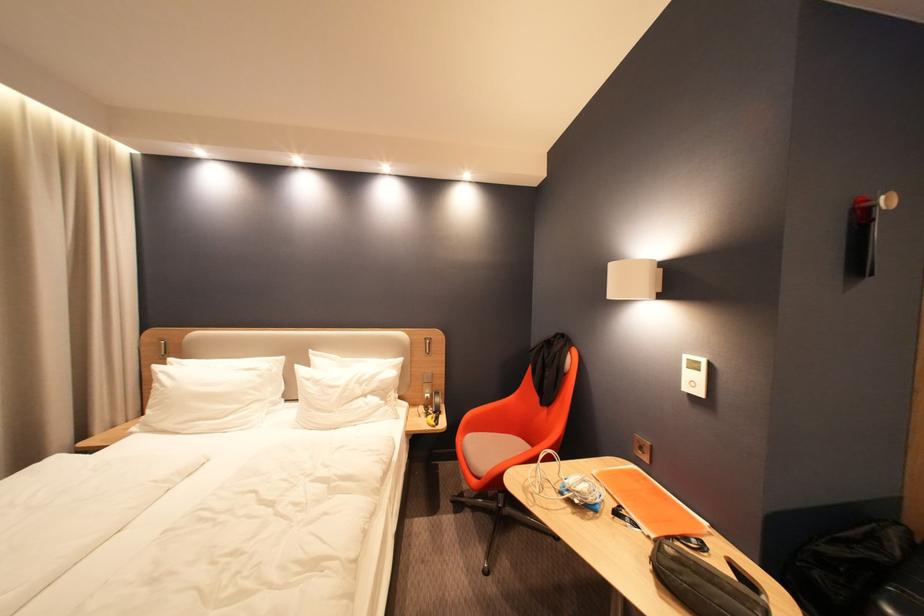
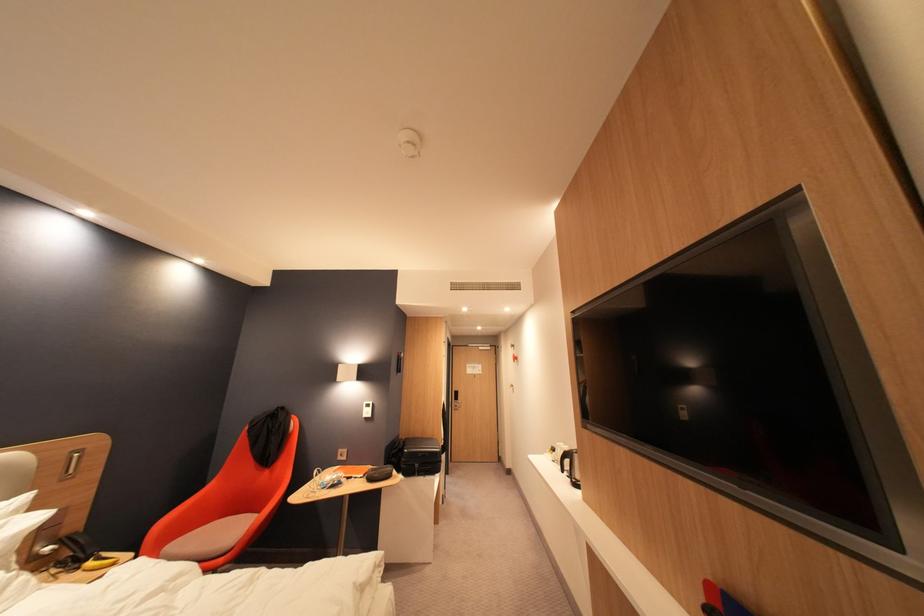
Where in the second image is the point corresponding to pixel 659 538 from the first image?

(371, 477)